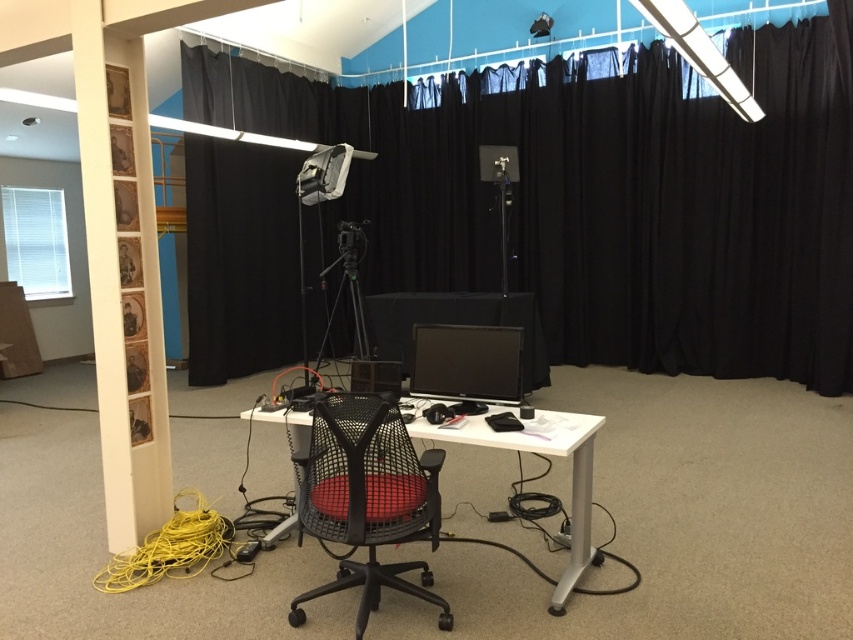
You are setting up a new monitor in the studio. The white plastic computer desk at center has a limited space. Can you place the matte black monitor at center to the left of the desk?

The white plastic computer desk at center is positioned on the right side of matte black monitor at center, so the matte black monitor at center is already to the left of the desk. Therefore, it is already placed correctly.

You are setting up a camera on the white plastic computer desk at center and need to position it so that it can capture the matte black monitor at center clearly. Considering their heights, will the camera have to be angled upward or downward to focus on the monitor?

The white plastic computer desk at center is much taller than the matte black monitor at center. Therefore, the camera will need to be angled downward to focus on the monitor.

You are a photographer setting up equipment in the studio. You need to adjust the height of the matte black monitor at center so that it is level with the top of the mesh black swivel chair at center. Based on the scene description, what should you do?

The mesh black swivel chair at center is taller than the matte black monitor at center. To make them level, you should raise the matte black monitor at center to match the height of the mesh black swivel chair at center.